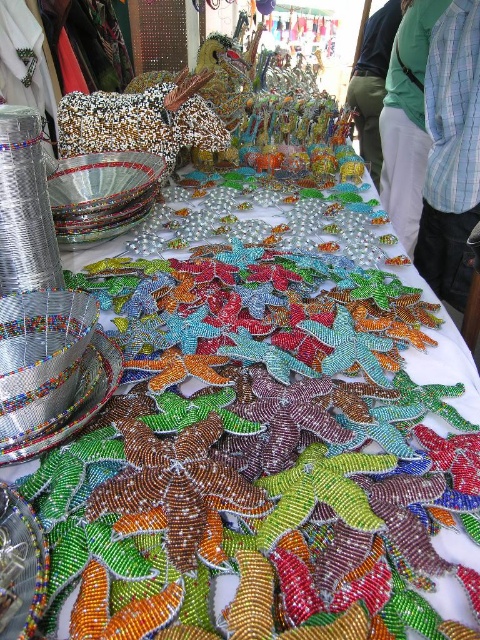
Does blue plaid shirt at upper right have a lesser width compared to green fabric pants at center?

Indeed, blue plaid shirt at upper right has a lesser width compared to green fabric pants at center.

Which is more to the left, blue plaid shirt at upper right or green fabric pants at center?

Positioned to the left is blue plaid shirt at upper right.

The height and width of the screenshot is (640, 480). I want to click on blue plaid shirt at upper right, so click(451, 154).

You are a GUI agent. You are given a task and a screenshot of the screen. Output one action in this format:
    pyautogui.click(x=<x>, y=<y>)
    Task: Click on the blue plaid shirt at upper right
    
    Given the screenshot: What is the action you would take?
    pyautogui.click(x=451, y=154)

Which is in front, point (469, 182) or point (430, 1)?

Point (469, 182) is more forward.

Between point (459, 177) and point (424, 131), which one is positioned behind?

The point (424, 131) is more distant.

The image size is (480, 640). What are the coordinates of `blue plaid shirt at upper right` in the screenshot? It's located at (451, 154).

Can you confirm if green fabric at upper center is positioned below green fabric pants at center?

Indeed, green fabric at upper center is positioned under green fabric pants at center.

Who is positioned more to the right, green fabric at upper center or green fabric pants at center?

green fabric at upper center

Who is more forward, (389,205) or (376,184)?

Point (389,205) is more forward.

At what (x,y) coordinates should I click in order to perform the action: click on green fabric at upper center. Please return your answer as a coordinate pair (x, y). Looking at the image, I should click on (407, 120).